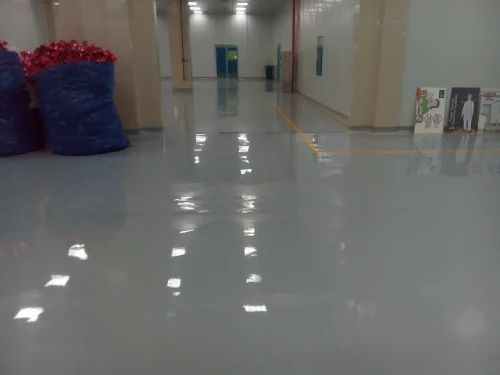
Locate an element on the screen. This screenshot has height=375, width=500. door is located at coordinates (278, 55), (225, 65), (231, 72).